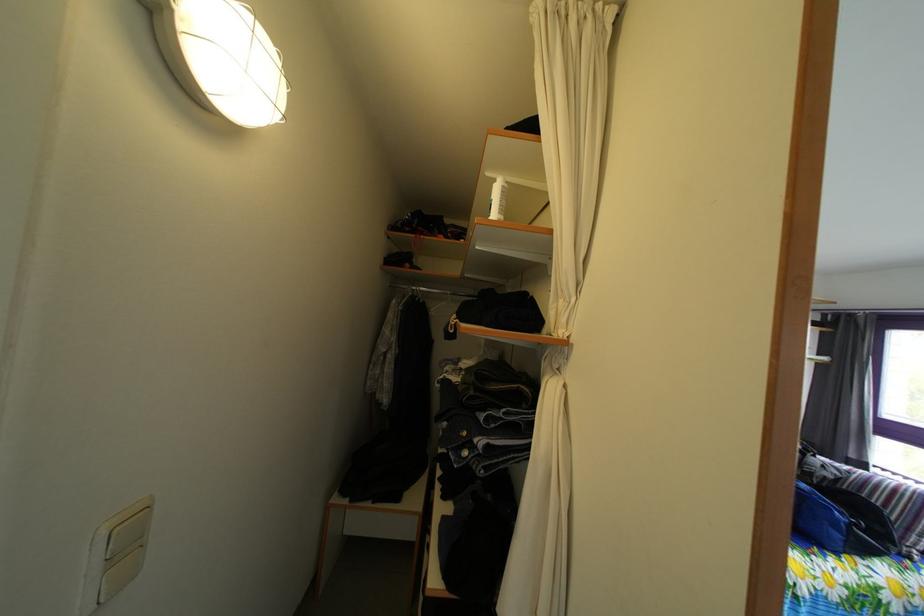
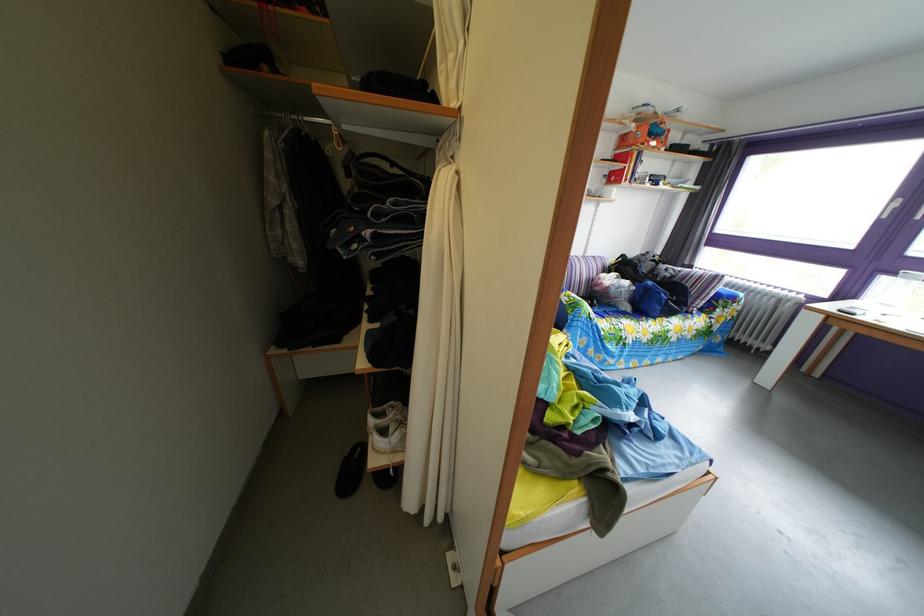
The point at (x=815, y=493) is marked in the first image. Where is the corresponding point in the second image?

(661, 291)